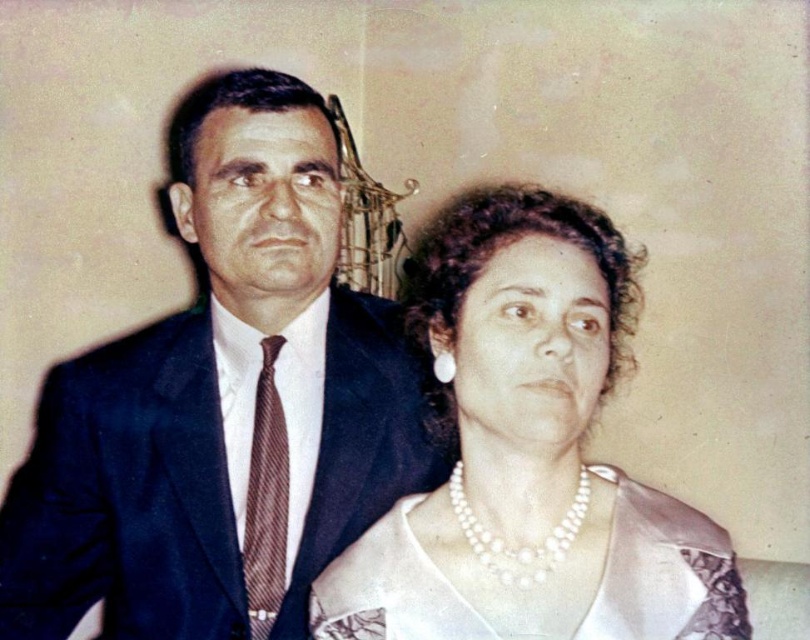
Question: Is dark blue suit at left further to camera compared to white satin dress at center?

Choices:
 (A) no
 (B) yes

Answer: (B)

Question: Is dark blue suit at left to the left of brown striped tie at left from the viewer's perspective?

Choices:
 (A) yes
 (B) no

Answer: (A)

Question: Which of the following is the closest to the observer?

Choices:
 (A) (646, 636)
 (B) (266, 381)
 (C) (282, 520)
 (D) (536, 390)

Answer: (D)

Question: Among these points, which one is nearest to the camera?

Choices:
 (A) (391, 561)
 (B) (695, 605)
 (C) (273, 490)

Answer: (B)

Question: Which of these objects is positioned farthest from the pearl necklace at upper right?

Choices:
 (A) white satin dress at center
 (B) brown striped tie at left
 (C) dark blue suit at left

Answer: (B)

Question: Is pearl necklace at upper right positioned in front of white satin dress at center?

Choices:
 (A) no
 (B) yes

Answer: (B)